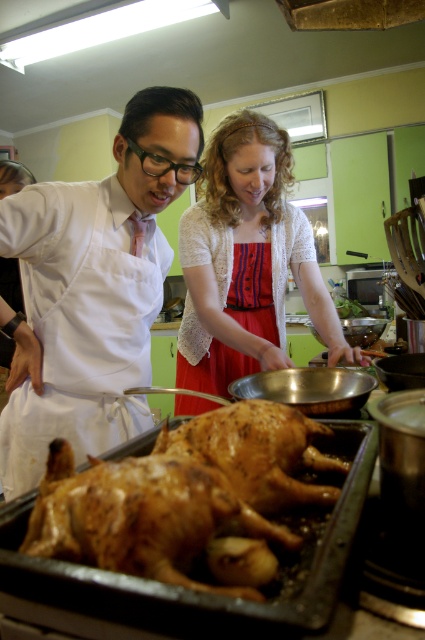
You are a chef who just finished cooking and want to check the status of the golden crispy skin at center and the red lace apron at center. Which one is closer to the viewer?

The red lace apron at center is closer to the viewer since it is positioned over the golden crispy skin at center.

You are a chef wearing a white apron at left and you need to take a photo of the roasted chickens in the roasting pan. Is the camera within your reach?

The white apron at left and camera are 38.52 inches apart. Since the average human arm length is about 27 inches, the camera is out of reach unless you move closer.

You are a chef wearing a white apron at left and need to reach for a recipe book placed near the red satin dress at center. Can you comfortably reach the book without moving your position?

The white apron at left is 13.81 inches away from the red satin dress at center. Since this distance is within typical arm reach, the chef can comfortably reach the recipe book without moving.